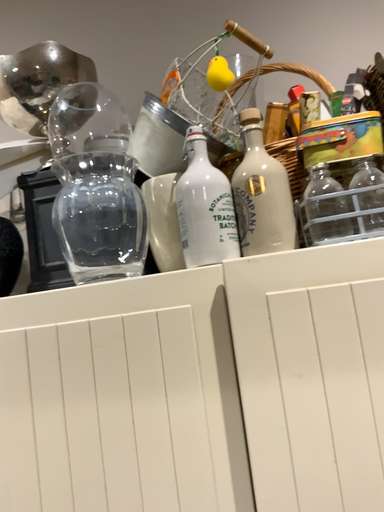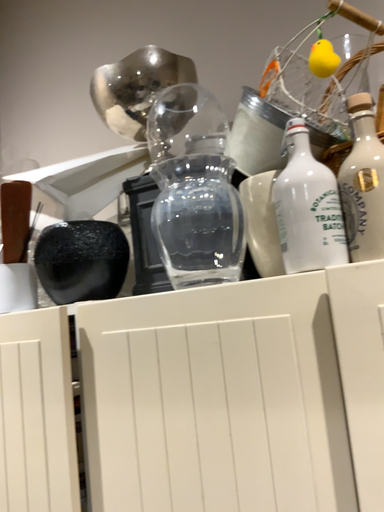
Question: How did the camera likely rotate when shooting the video?

Choices:
 (A) rotated left
 (B) rotated right

Answer: (A)